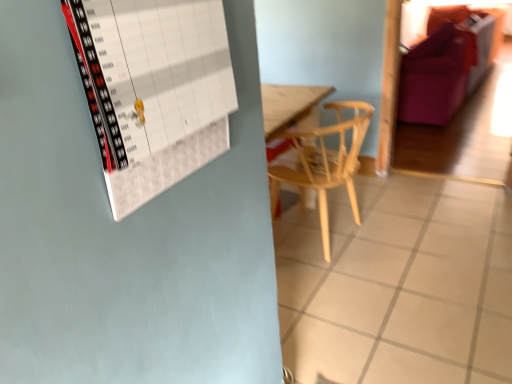
Question: In terms of height, does light wood chair at center look taller or shorter compared to white tile at center?

Choices:
 (A) tall
 (B) short

Answer: (A)

Question: From a real-world perspective, is light wood chair at center physically located above or below white tile at center?

Choices:
 (A) below
 (B) above

Answer: (B)

Question: Considering the real-world distances, which object is closest to the light wood chair at center?

Choices:
 (A) white paper calendar at upper left
 (B) white tile at center
 (C) purple fabric couch at upper right

Answer: (B)

Question: Based on their relative distances, which object is nearer to the light wood chair at center?

Choices:
 (A) purple fabric couch at upper right
 (B) white tile at center
 (C) white paper calendar at upper left

Answer: (B)